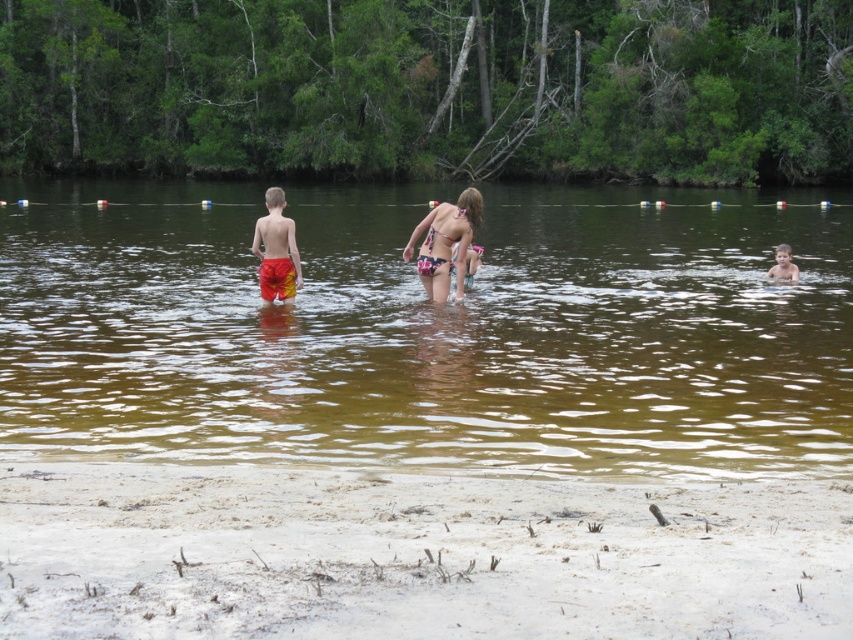
Question: Estimate the real-world distances between objects in this image. Which object is closer to the smooth skin boy at right?

Choices:
 (A) red/yellow shorts at center
 (B) brown murky water at center
 (C) printed bikini at center

Answer: (C)

Question: Does brown murky water at center appear on the left side of red/yellow shorts at center?

Choices:
 (A) yes
 (B) no

Answer: (B)

Question: Does red/yellow shorts at center have a greater width compared to smooth skin boy at right?

Choices:
 (A) yes
 (B) no

Answer: (A)

Question: Among these points, which one is farthest from the camera?

Choices:
 (A) (779, 269)
 (B) (421, 259)
 (C) (294, 280)

Answer: (A)

Question: Which point is closer to the camera taking this photo?

Choices:
 (A) (775, 264)
 (B) (463, 243)
 (C) (289, 300)

Answer: (B)

Question: In this image, where is brown murky water at center located relative to printed bikini at center?

Choices:
 (A) above
 (B) below

Answer: (A)